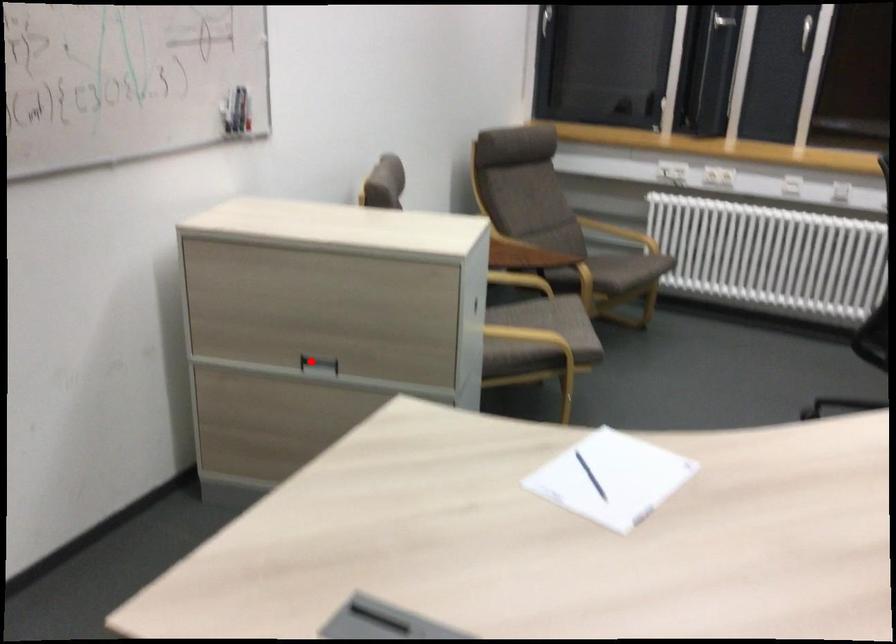
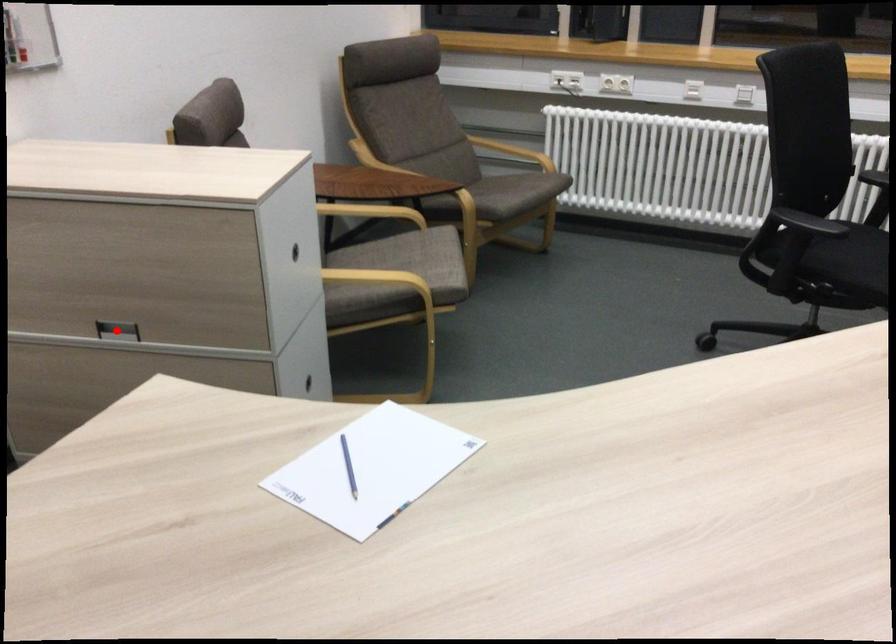
I am providing you with two images of the same scene from different viewpoints. A red point is marked on the first image and another point is marked on the second image. Does the point marked in image1 correspond to the same location as the one in image2?

Yes